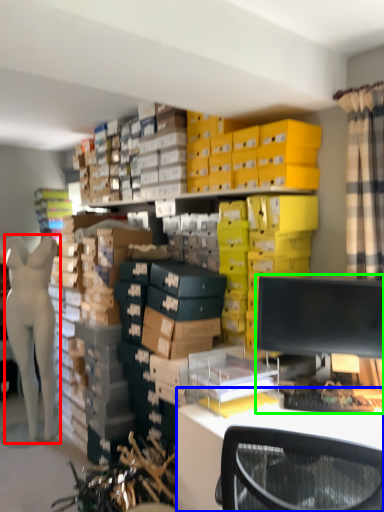
Question: Which is nearer to the person (highlighted by a red box)? desk (highlighted by a blue box) or desktop computer (highlighted by a green box).

Choices:
 (A) desk
 (B) desktop computer

Answer: (A)